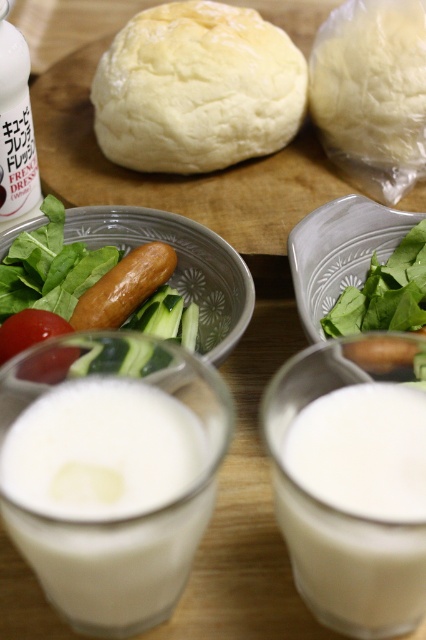
Does point (412, 51) come behind point (201, 307)?

Yes, point (412, 51) is behind point (201, 307).

Who is higher up, white matte dough at upper right or white matte bowl at center?

white matte dough at upper right

Does point (408, 88) come closer to viewer compared to point (81, 205)?

No, (408, 88) is further to viewer.

Locate an element on the screen. white matte dough at upper right is located at coordinates (371, 81).

Between white opaque liquid at center and white matte bowl at center, which one has less height?

white matte bowl at center

This screenshot has width=426, height=640. What do you see at coordinates (356, 508) in the screenshot? I see `white opaque liquid at center` at bounding box center [356, 508].

Locate an element on the screen. The height and width of the screenshot is (640, 426). white opaque liquid at center is located at coordinates (356, 508).

Does green matte bowl at center appear on the right side of red matte tomato at lower left?

Yes, green matte bowl at center is to the right of red matte tomato at lower left.

Can you confirm if green matte bowl at center is positioned to the left of red matte tomato at lower left?

No, green matte bowl at center is not to the left of red matte tomato at lower left.

Is point (328, 214) positioned in front of point (54, 316)?

No, (328, 214) is further to viewer.

Identify the location of green matte bowl at center. (339, 252).